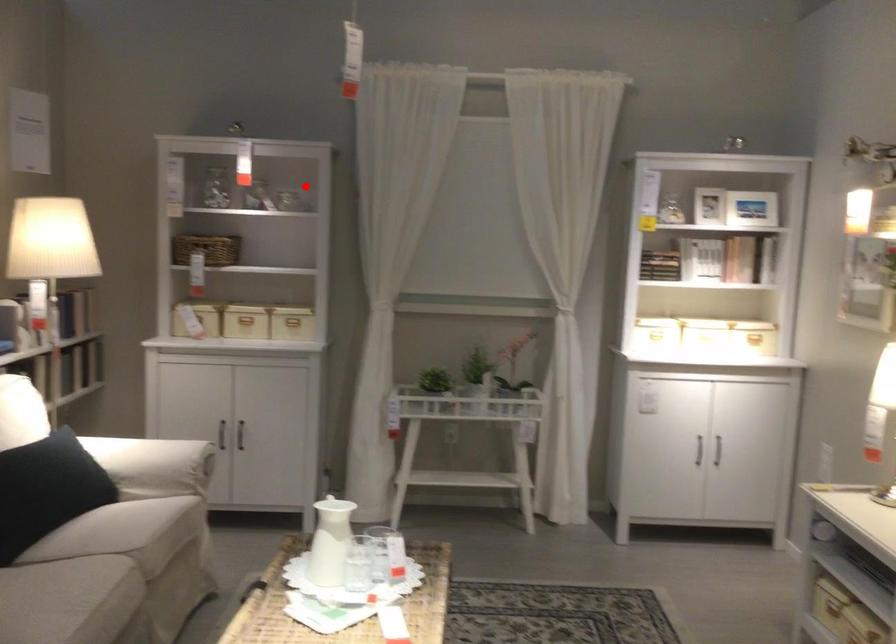
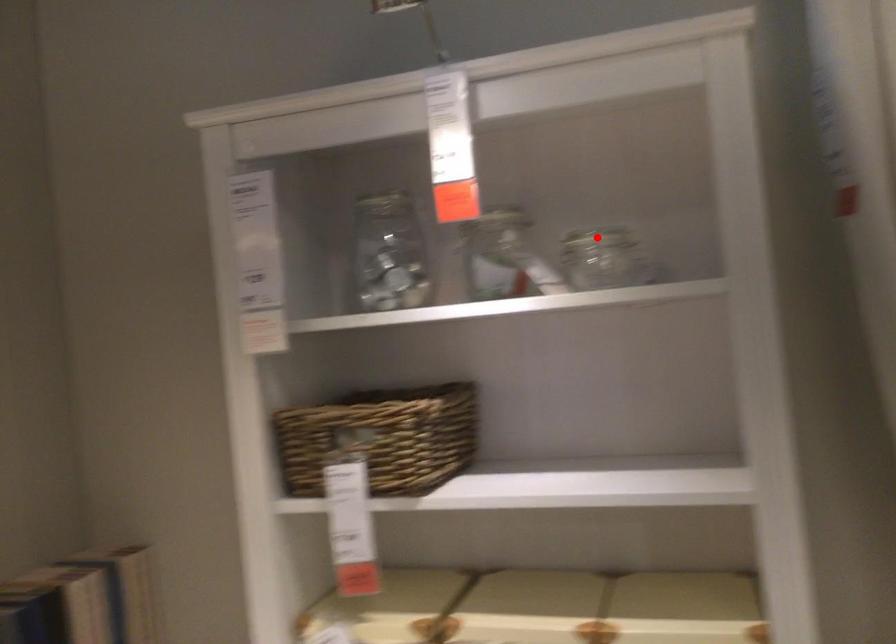
I am providing you with two images of the same scene from different viewpoints. A red point is marked on the first image and another point is marked on the second image. Does the point marked in image1 correspond to the same location as the one in image2?

Yes